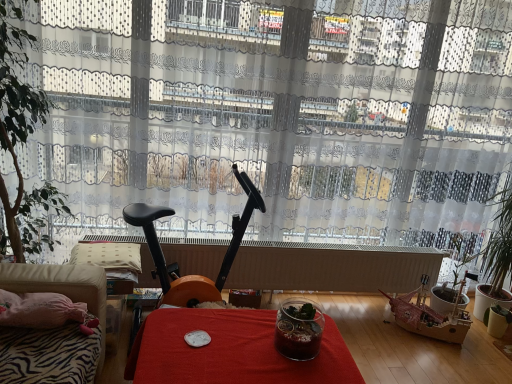
Question: From a real-world perspective, is red fabric table at center located higher than green leafy plant at right, the 2th houseplant viewed from the left?

Choices:
 (A) yes
 (B) no

Answer: (B)

Question: Is red fabric table at center aimed at green leafy plant at right, the 2th houseplant viewed from the left?

Choices:
 (A) yes
 (B) no

Answer: (B)

Question: Is red fabric table at center thinner than green leafy plant at right, the first houseplant viewed from the back?

Choices:
 (A) no
 (B) yes

Answer: (A)

Question: From the image's perspective, is red fabric table at center located above green leafy plant at right, the first houseplant ordered from the bottom?

Choices:
 (A) yes
 (B) no

Answer: (B)

Question: Is red fabric table at center facing away from green leafy plant at right, the 2th houseplant viewed from the front?

Choices:
 (A) yes
 (B) no

Answer: (B)

Question: From the image's perspective, is green leafy plant at right, which is the first houseplant from right to left, positioned above or below red fabric table at center?

Choices:
 (A) below
 (B) above

Answer: (B)

Question: In terms of size, does green leafy plant at right, which is the first houseplant from right to left, appear bigger or smaller than red fabric table at center?

Choices:
 (A) big
 (B) small

Answer: (B)

Question: Considering their positions, is green leafy plant at right, which is the first houseplant from right to left, located in front of or behind red fabric table at center?

Choices:
 (A) front
 (B) behind

Answer: (B)

Question: From their relative heights in the image, would you say green leafy plant at right, the 2th houseplant viewed from the left, is taller or shorter than red fabric table at center?

Choices:
 (A) tall
 (B) short

Answer: (A)

Question: Choose the correct answer: Is transparent glass jar at center inside green leafy plant at right, positioned as the 2th houseplant in top-to-bottom order, or outside it?

Choices:
 (A) inside
 (B) outside

Answer: (B)

Question: Looking at their shapes, would you say transparent glass jar at center is wider or thinner than green leafy plant at right, positioned as the 2th houseplant in top-to-bottom order?

Choices:
 (A) thin
 (B) wide

Answer: (A)

Question: In terms of size, does transparent glass jar at center appear bigger or smaller than green leafy plant at right, which is the first houseplant from right to left?

Choices:
 (A) big
 (B) small

Answer: (B)

Question: From their relative heights in the image, would you say transparent glass jar at center is taller or shorter than green leafy plant at right, the 2th houseplant viewed from the left?

Choices:
 (A) short
 (B) tall

Answer: (A)

Question: In the image, is black plastic exercise bike at center positioned in front of or behind red fabric table at center?

Choices:
 (A) front
 (B) behind

Answer: (B)

Question: From a real-world perspective, is black plastic exercise bike at center physically located above or below red fabric table at center?

Choices:
 (A) below
 (B) above

Answer: (B)